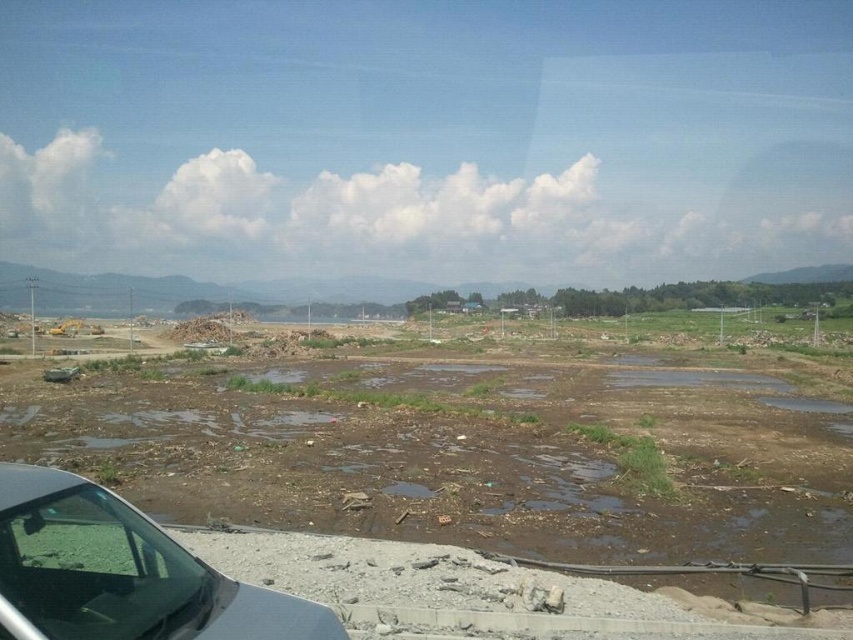
You are standing at the construction site shown in the image. You notice two points marked on the ground. The first point is at coordinates point (807, 458) and the second is at point (177, 580). Which point is closer to your current position?

Point (177, 580) is closer to your current position because it is closer to the camera than point (807, 458), which is further away.